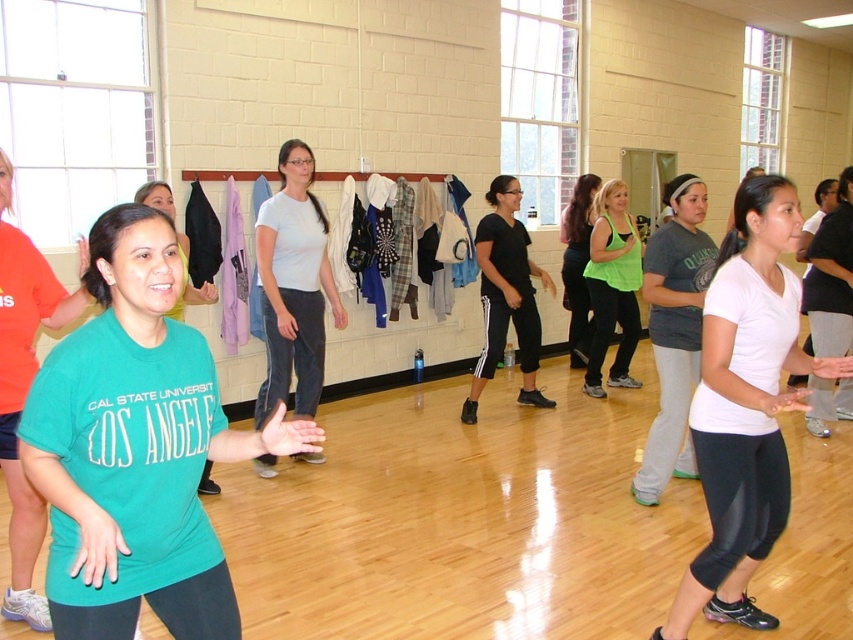
You are standing at the point labeled as point (56, 480) in the image. A friend is standing exactly where you are viewing from. How far apart are you and your friend?

The distance between you and your friend is 1.60 meters because the point (56, 480) and the viewer are 1.60 meters apart from each other.